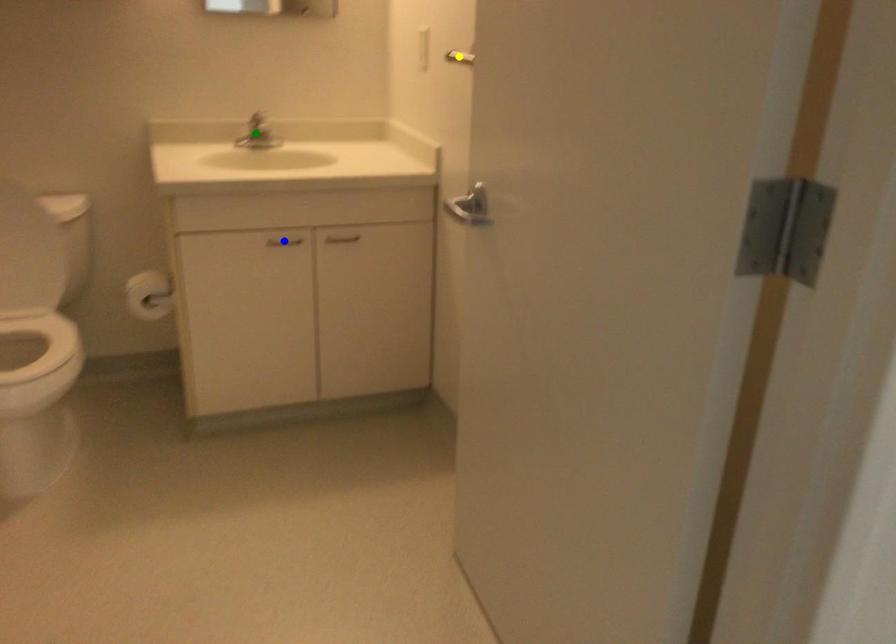
Order these from farthest to nearest:
green point
blue point
yellow point

green point → blue point → yellow point